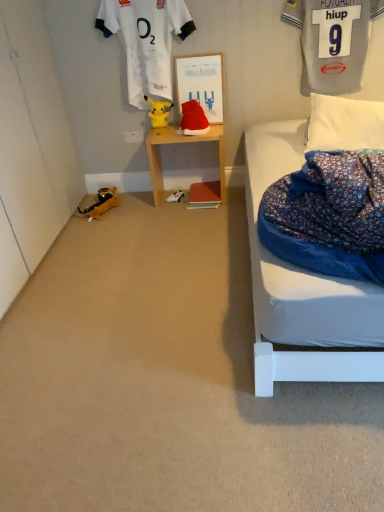
Where is `free space in front of white plastic game controller at center`? free space in front of white plastic game controller at center is located at coordinates (175, 207).